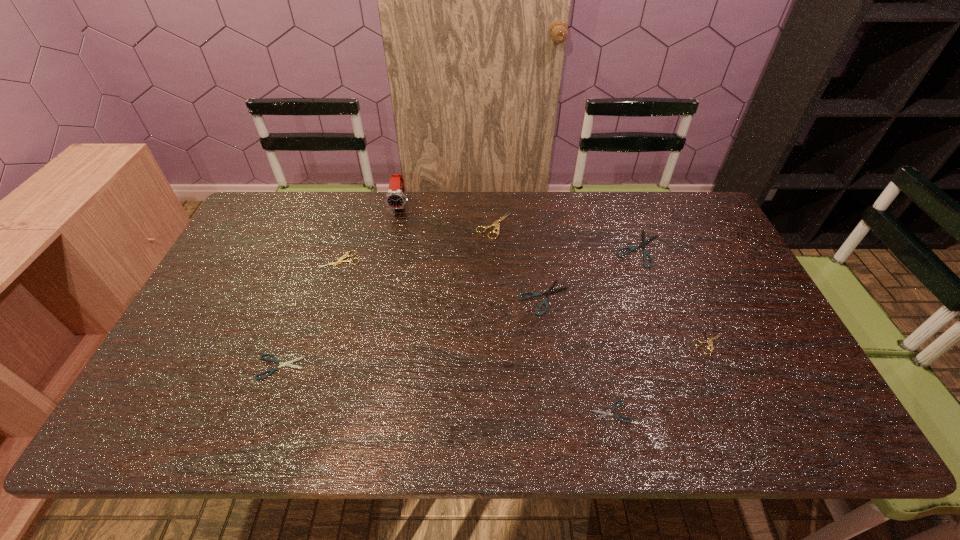
Find the location of a particular element. vacant space that is in between the leftmost black shears and the third nearest black shears is located at coordinates (412, 332).

Identify the location of vacant point located between the second farthest beige shears and the biggest black shears. (490, 254).

Identify which object is the fifth closest to the smallest beige shears. Please provide its 2D coordinates. Your answer should be formatted as a tuple, i.e. [(x, y)], where the tuple contains the x and y coordinates of a point satisfying the conditions above.

[(395, 198)]

Identify which object is the seventh nearest to the third biggest black shears. Please provide its 2D coordinates. Your answer should be formatted as a tuple, i.e. [(x, y)], where the tuple contains the x and y coordinates of a point satisfying the conditions above.

[(709, 340)]

You are a GUI agent. You are given a task and a screenshot of the screen. Output one action in this format:
    pyautogui.click(x=<x>, y=<y>)
    Task: Click on the second closest shears to the biggest beige shears
    This screenshot has height=540, width=960.
    Given the screenshot: What is the action you would take?
    pyautogui.click(x=645, y=253)

Point out which shears is positioned as the sixth nearest to the smallest beige shears. Please provide its 2D coordinates. Your answer should be formatted as a tuple, i.e. [(x, y)], where the tuple contains the x and y coordinates of a point satisfying the conditions above.

[(275, 360)]

What are the coordinates of `the closest beige shears to the second farthest beige shears` in the screenshot? It's located at (496, 223).

Where is `beige shears that is the second nearest to the third biggest black shears`? beige shears that is the second nearest to the third biggest black shears is located at coordinates (496, 223).

This screenshot has height=540, width=960. In order to click on black shears that is the fourth closest to the third object from left to right in this screenshot , I will do `click(604, 413)`.

Identify the location of black shears that can be found as the fourth closest to the watch. Image resolution: width=960 pixels, height=540 pixels. (604, 413).